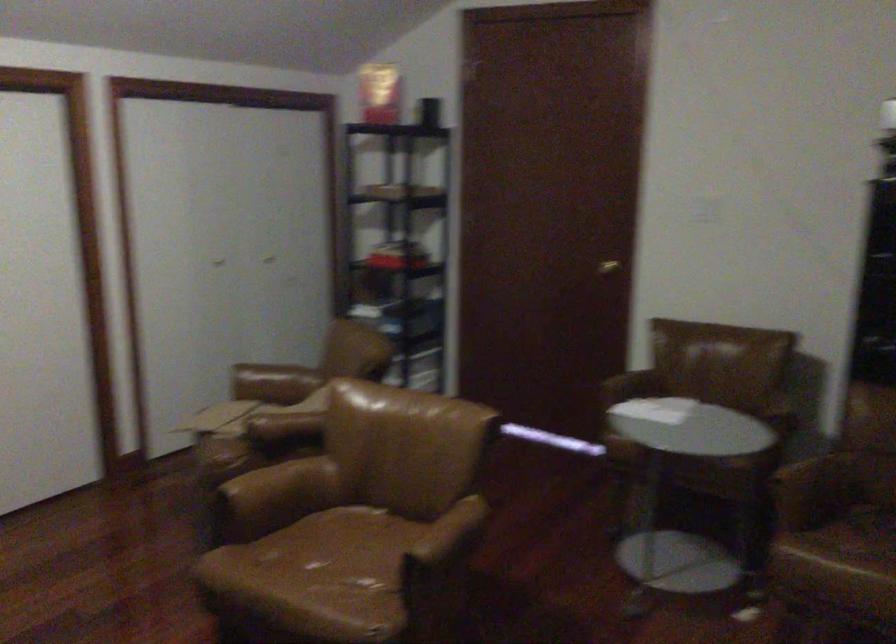
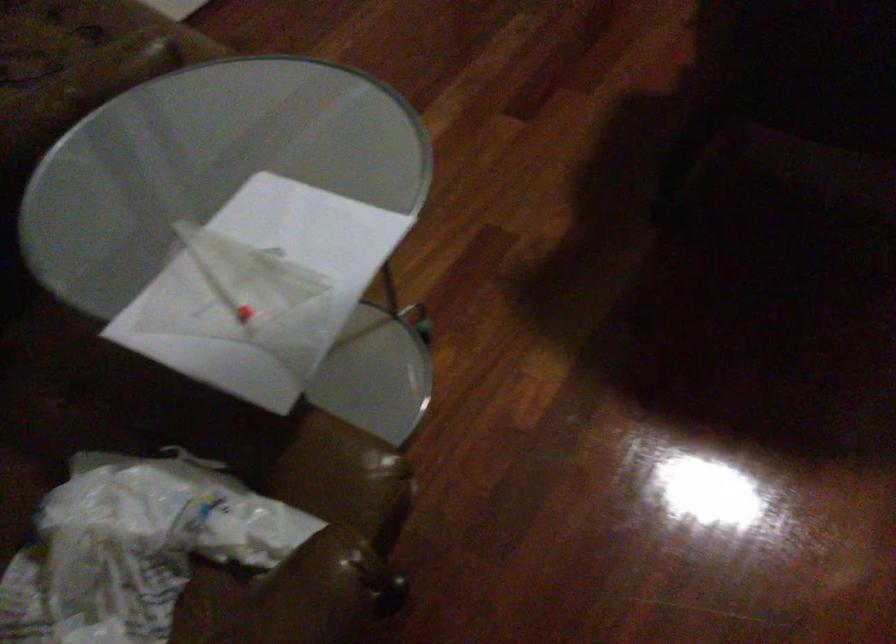
Find the pixel in the second image that matches point (674, 408) in the first image.

(134, 547)